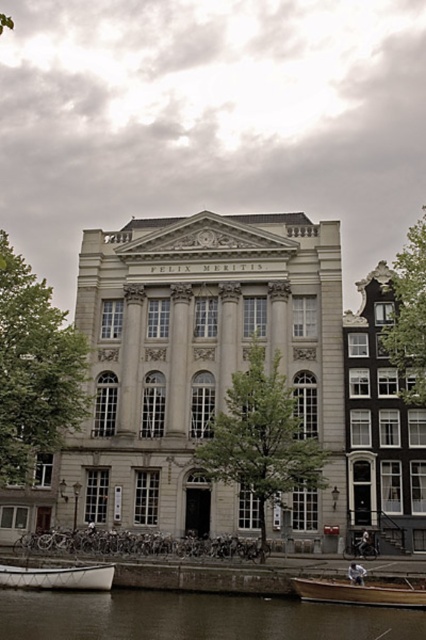
Which is behind, point (253, 481) or point (385, 339)?

The point (385, 339) is more distant.

Between green leafy tree at center and green leafy tree at upper right, which one has more height?

Standing taller between the two is green leafy tree at upper right.

Is point (290, 454) positioned after point (411, 296)?

No, (290, 454) is in front of (411, 296).

This screenshot has width=426, height=640. Identify the location of green leafy tree at center. (261, 440).

Which of these two, green leafy tree at center or wooden boat at lower right, stands shorter?

wooden boat at lower right

Is point (238, 392) positioned in front of point (319, 586)?

No, (238, 392) is behind (319, 586).

You are a GUI agent. You are given a task and a screenshot of the screen. Output one action in this format:
    pyautogui.click(x=<x>, y=<y>)
    Task: Click on the green leafy tree at center
    This screenshot has height=640, width=426.
    Given the screenshot: What is the action you would take?
    pyautogui.click(x=261, y=440)

Which of these two, green leafy tree at left or green leafy tree at center, stands taller?

green leafy tree at left is taller.

What are the coordinates of `green leafy tree at left` in the screenshot? It's located at (34, 369).

Image resolution: width=426 pixels, height=640 pixels. In order to click on green leafy tree at left in this screenshot , I will do `click(34, 369)`.